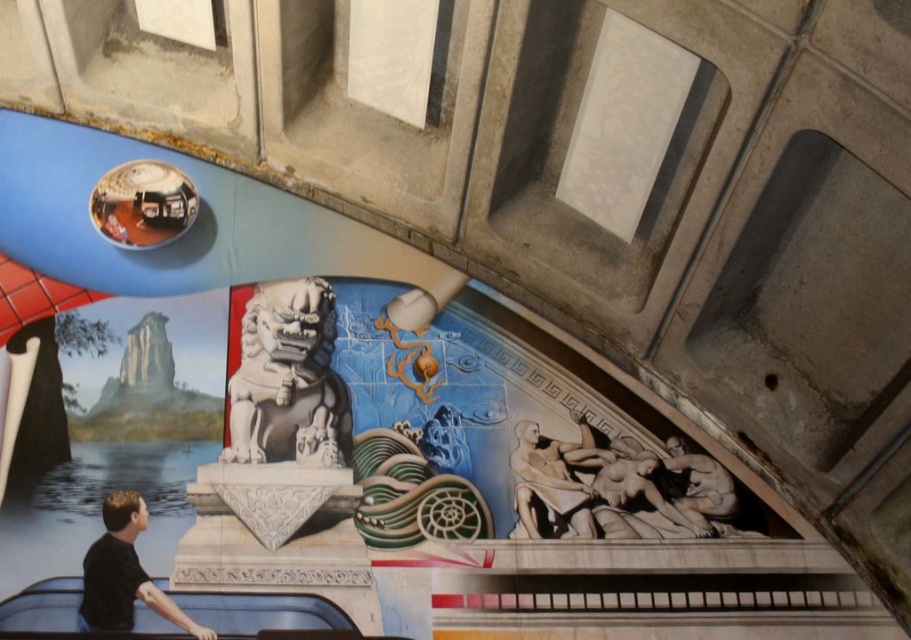
Question: Based on their relative distances, which object is nearer to the black matte shirt at lower left?

Choices:
 (A) white stone lion at center
 (B) smooth stone statue at lower right

Answer: (A)

Question: Can you confirm if black matte shirt at lower left is positioned above beige marble statue at lower right?

Choices:
 (A) yes
 (B) no

Answer: (B)

Question: Among these points, which one is nearest to the camera?

Choices:
 (A) (106, 544)
 (B) (539, 532)

Answer: (A)

Question: Does black matte shirt at lower left have a lesser width compared to smooth stone statue at lower right?

Choices:
 (A) yes
 (B) no

Answer: (B)

Question: Does black matte shirt at lower left have a lesser width compared to beige marble statue at lower right?

Choices:
 (A) yes
 (B) no

Answer: (B)

Question: Which point is farther from the camera taking this photo?

Choices:
 (A) tap(582, 512)
 (B) tap(252, 312)
 (C) tap(99, 572)

Answer: (B)